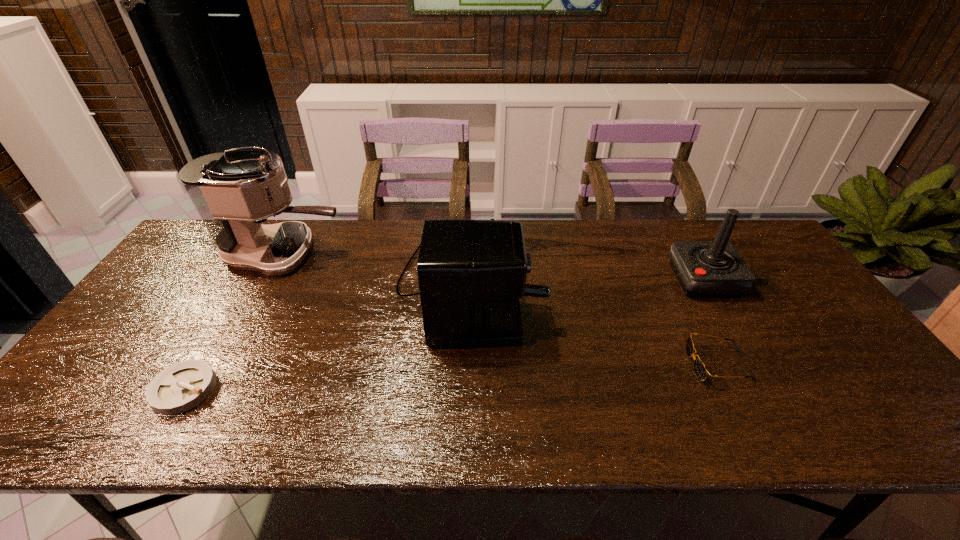
I want to click on vacant space at the far edge, so click(619, 256).

In the image, there is a desktop. Identify the location of vacant space at the near edge. (450, 416).

Locate an element on the screen. Image resolution: width=960 pixels, height=540 pixels. vacant region at the left edge of the desktop is located at coordinates (171, 334).

Identify the location of free space at the right edge of the desktop. This screenshot has height=540, width=960. (823, 325).

Find the location of a particular element. Image resolution: width=960 pixels, height=540 pixels. free space between the third object from left to right and the sunglasses is located at coordinates (593, 325).

The width and height of the screenshot is (960, 540). I want to click on free space between the ashtray and the left coffee maker, so click(234, 322).

Locate an element on the screen. This screenshot has height=540, width=960. vacant space that's between the joystick and the third object from left to right is located at coordinates (587, 282).

You are a GUI agent. You are given a task and a screenshot of the screen. Output one action in this format:
    pyautogui.click(x=<x>, y=<y>)
    Task: Click on the vacant space in between the ashtray and the second shortest object
    This screenshot has width=960, height=540.
    Given the screenshot: What is the action you would take?
    pyautogui.click(x=451, y=377)

At what (x,y) coordinates should I click in order to perform the action: click on free point between the joystick and the third object from left to right. Please return your answer as a coordinate pair (x, y). The height and width of the screenshot is (540, 960). Looking at the image, I should click on (587, 282).

Where is `vacant space that's between the shortest object and the sunglasses`? vacant space that's between the shortest object and the sunglasses is located at coordinates (451, 377).